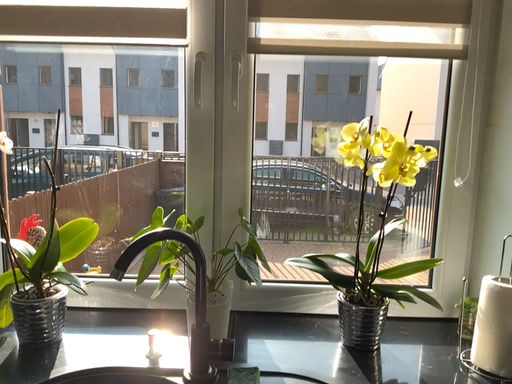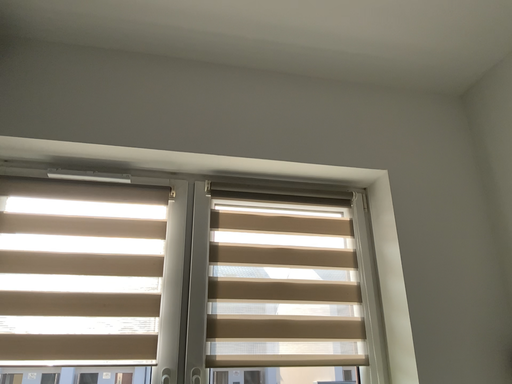
Question: How did the camera likely rotate when shooting the video?

Choices:
 (A) rotated downward
 (B) rotated upward

Answer: (B)